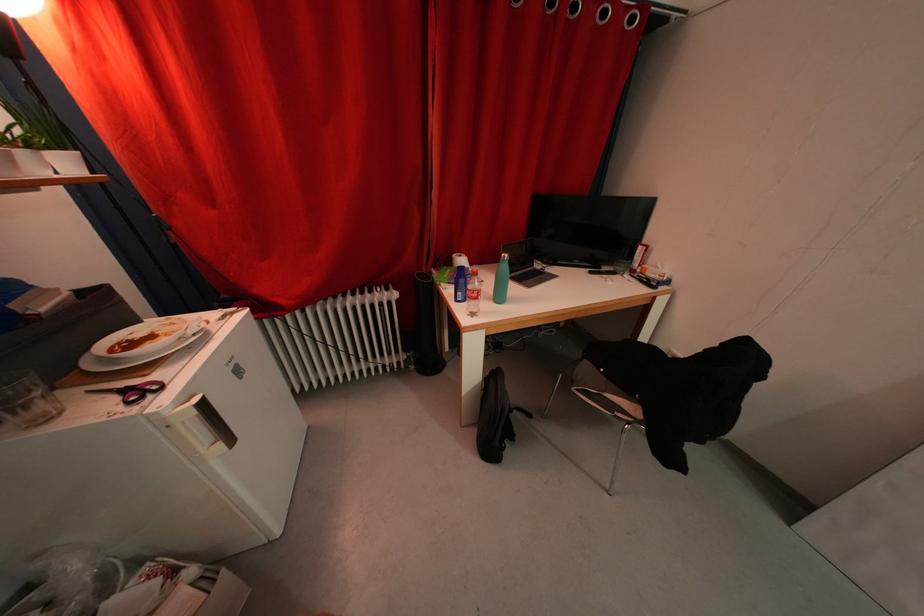
Describe the element at coordinates (669, 391) in the screenshot. This screenshot has width=924, height=616. I see `the chair sitting surface` at that location.